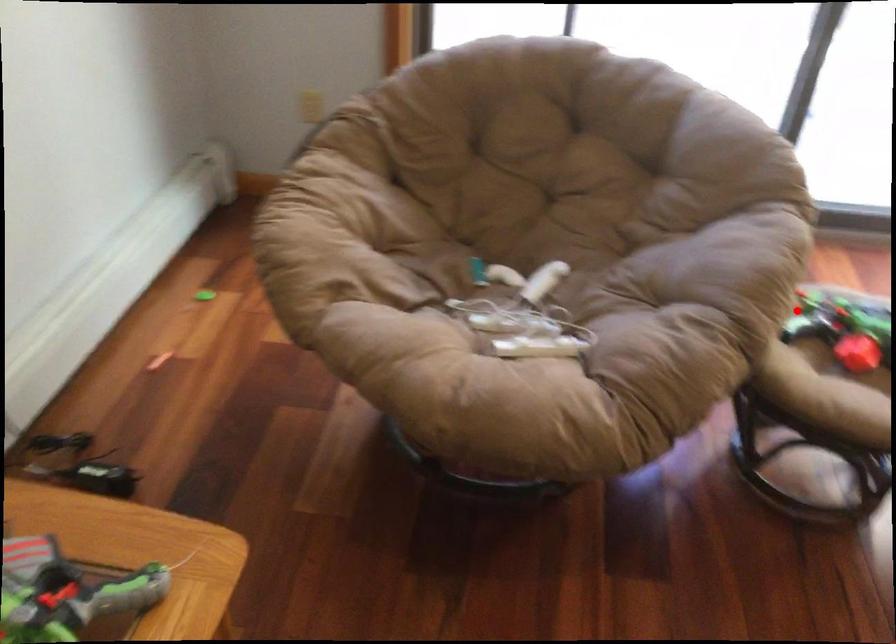
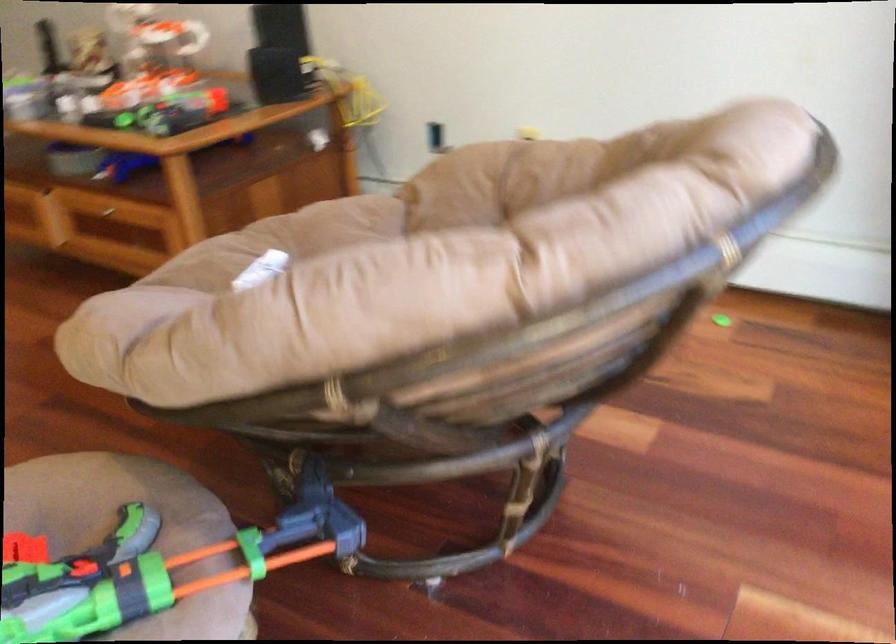
Find the pixel in the second image that matches the highlighted location in the first image.

(133, 532)